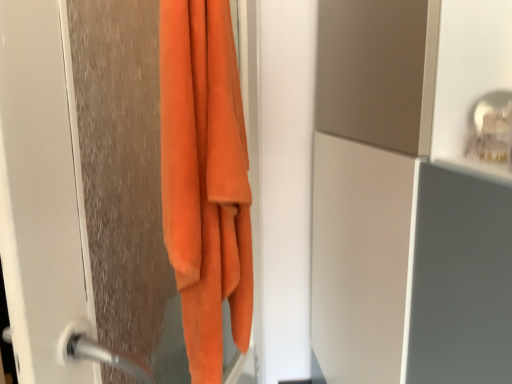
Question: Is orange fuzzy towel at left completely or partially inside orange soft towel at left?

Choices:
 (A) no
 (B) yes

Answer: (A)

Question: Considering the relative sizes of orange soft towel at left and orange fuzzy towel at left in the image provided, is orange soft towel at left shorter than orange fuzzy towel at left?

Choices:
 (A) no
 (B) yes

Answer: (B)

Question: Is the surface of orange soft towel at left in direct contact with orange fuzzy towel at left?

Choices:
 (A) yes
 (B) no

Answer: (A)

Question: Is orange soft towel at left outside orange fuzzy towel at left?

Choices:
 (A) yes
 (B) no

Answer: (B)

Question: From the image's perspective, is orange soft towel at left located beneath orange fuzzy towel at left?

Choices:
 (A) no
 (B) yes

Answer: (A)

Question: Is orange soft towel at left to the left of orange fuzzy towel at left from the viewer's perspective?

Choices:
 (A) no
 (B) yes

Answer: (A)

Question: Is orange fuzzy towel at left far from orange soft towel at left?

Choices:
 (A) yes
 (B) no

Answer: (B)

Question: Considering the relative sizes of orange fuzzy towel at left and orange soft towel at left in the image provided, is orange fuzzy towel at left taller than orange soft towel at left?

Choices:
 (A) no
 (B) yes

Answer: (B)

Question: Is orange fuzzy towel at left wider than orange soft towel at left?

Choices:
 (A) no
 (B) yes

Answer: (B)

Question: From the image's perspective, is orange fuzzy towel at left beneath orange soft towel at left?

Choices:
 (A) yes
 (B) no

Answer: (A)

Question: Considering the relative positions of orange fuzzy towel at left and orange soft towel at left in the image provided, is orange fuzzy towel at left to the right of orange soft towel at left from the viewer's perspective?

Choices:
 (A) yes
 (B) no

Answer: (B)

Question: Is orange soft towel at left at the back of orange fuzzy towel at left?

Choices:
 (A) yes
 (B) no

Answer: (A)

Question: Looking at their shapes, would you say orange fuzzy towel at left is wider or thinner than orange soft towel at left?

Choices:
 (A) wide
 (B) thin

Answer: (A)